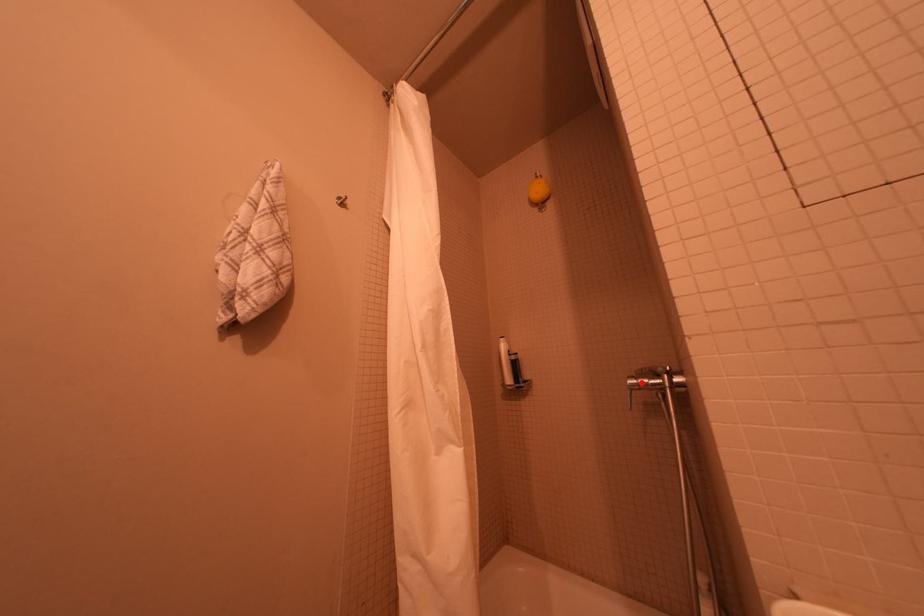
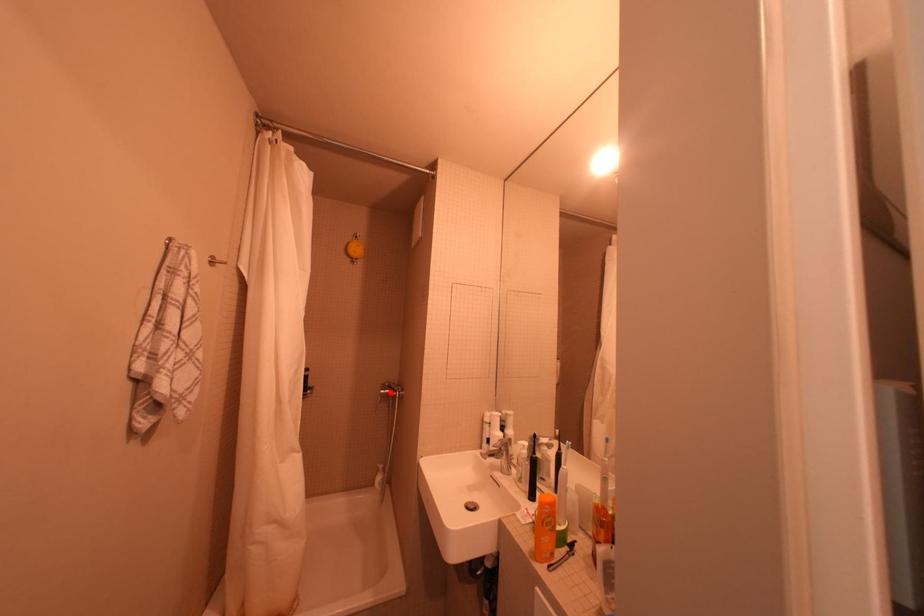
I am providing you with two images of the same scene from different viewpoints. A red point is marked on the first image and another point is marked on the second image. Are the points marked in image1 and image2 representing the same 3D position?

Yes